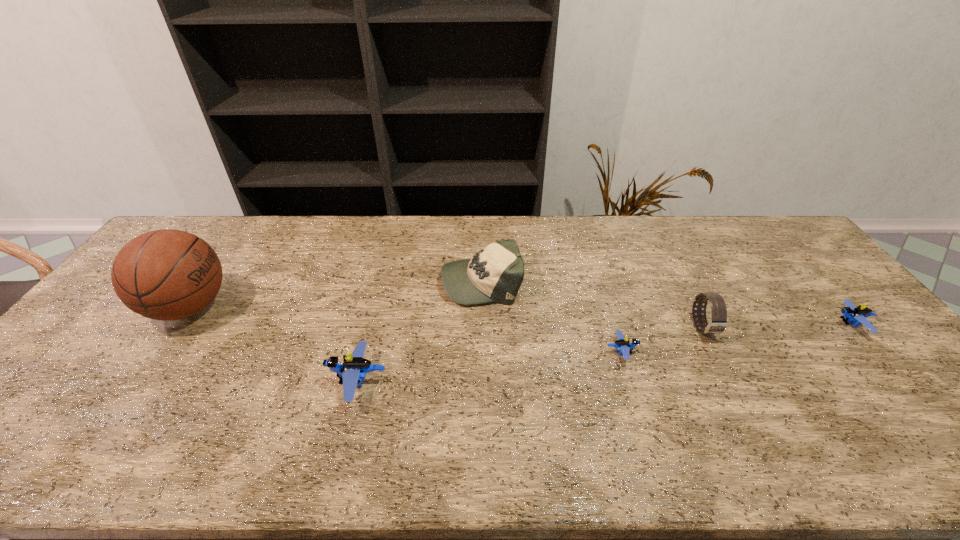
You are a GUI agent. You are given a task and a screenshot of the screen. Output one action in this format:
    pyautogui.click(x=<x>, y=<y>)
    Task: Click on the Lego that is the second closest to the baseball cap
    Image resolution: width=960 pixels, height=540 pixels.
    Given the screenshot: What is the action you would take?
    pyautogui.click(x=623, y=345)

In order to click on Lego that is the third nearest to the watch in this screenshot , I will do `click(354, 368)`.

Where is `free location that satisfies the following two spatial constraints: 1. on the face of the fifth object from left to right; 2. on the front-facing side of the leftmost Lego`? This screenshot has width=960, height=540. free location that satisfies the following two spatial constraints: 1. on the face of the fifth object from left to right; 2. on the front-facing side of the leftmost Lego is located at coordinates (731, 382).

Image resolution: width=960 pixels, height=540 pixels. Identify the location of free space in the image that satisfies the following two spatial constraints: 1. on the face of the second object from right to left; 2. on the front-facing side of the fourth object from left to right. (715, 352).